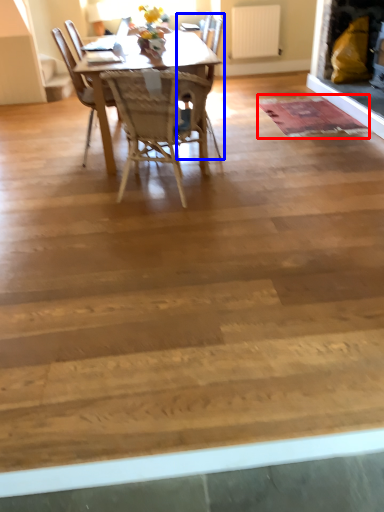
Question: Which object appears closest to the camera in this image, mat (highlighted by a red box) or chair (highlighted by a blue box)?

Choices:
 (A) mat
 (B) chair

Answer: (B)